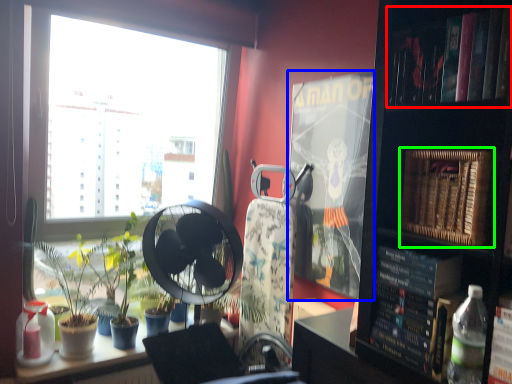
Question: Which is nearer to the book (highlighted by a red box)? paperback book (highlighted by a blue box) or paperback book (highlighted by a green box).

Choices:
 (A) paperback book
 (B) paperback book

Answer: (B)